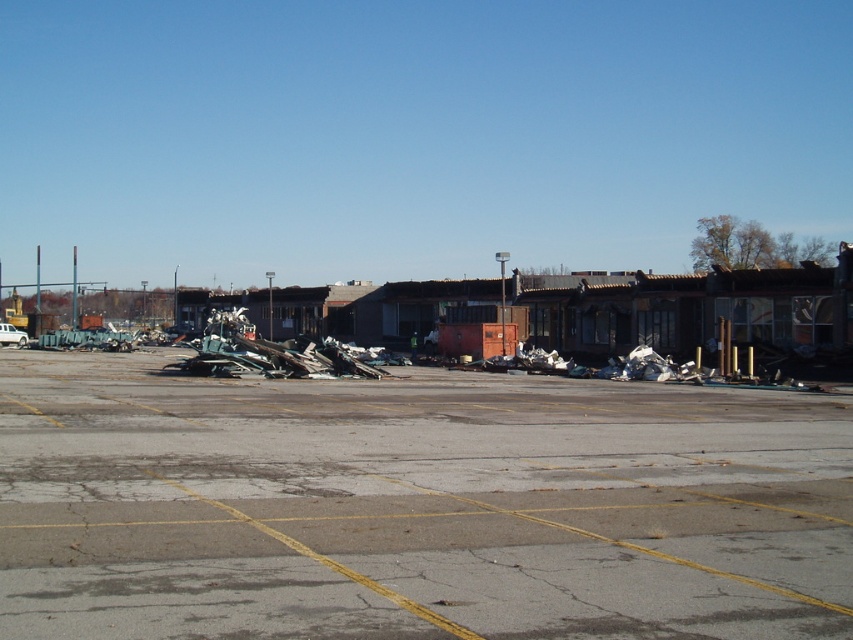
You are standing at the point marked by coordinates point (415, 506) in the parking lot. What is the surface material under your feet?

The gray asphalt parking lot at center is located at point (415, 506), so the surface material under your feet is asphalt.

You are driving a white matte truck at center and need to park it in the gray asphalt parking lot at center. Can the truck fit into the parking space based on their sizes?

The gray asphalt parking lot at center has a larger width than the white matte truck at center, so the truck can fit into the parking space.